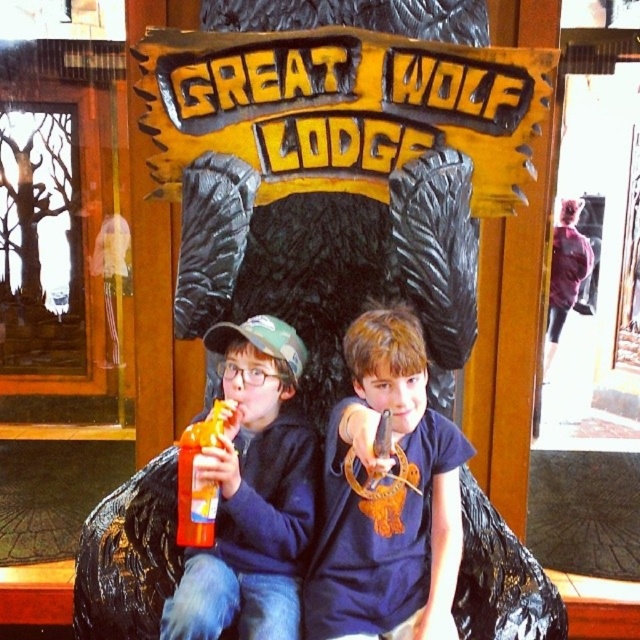
You are a photographer trying to capture the orange plastic bottle at center without the matte plastic soda at left blocking it. Can you move the soda to the side so the bottle is visible? Explain your reasoning.

The matte plastic soda at left is in front of the orange plastic bottle at center, so moving the soda to the side would allow the bottle to be visible.

You are a photographer trying to capture a photo of the blue matte shirt at center and the matte plastic soda at left. If you want to ensure both objects are fully visible in the frame, which object should you adjust your focus on to account for their sizes?

The blue matte shirt at center has a larger width than the matte plastic soda at left, so you should focus on the blue matte shirt at center to ensure both are fully visible.